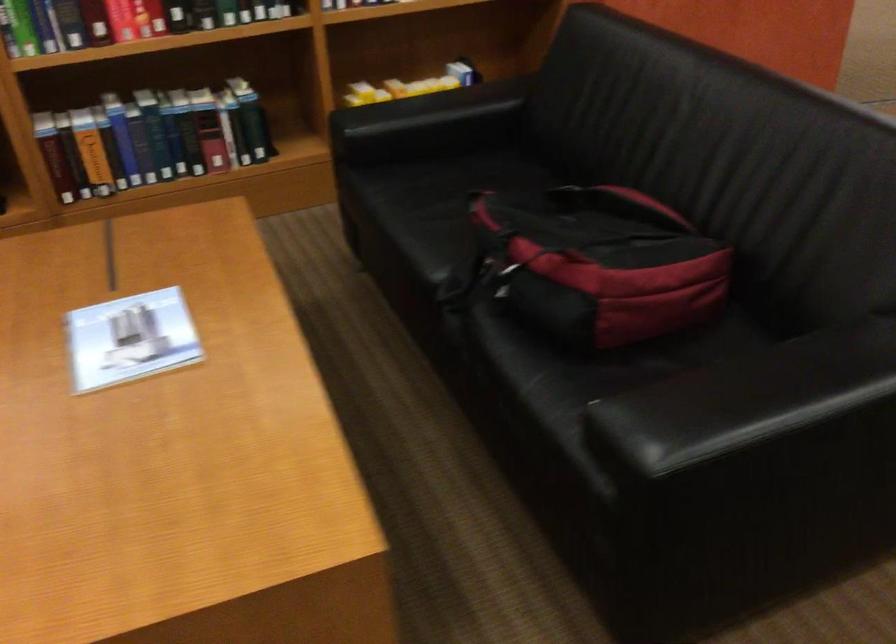
Describe the element at coordinates (495, 277) in the screenshot. I see `the black sofa sitting surface` at that location.